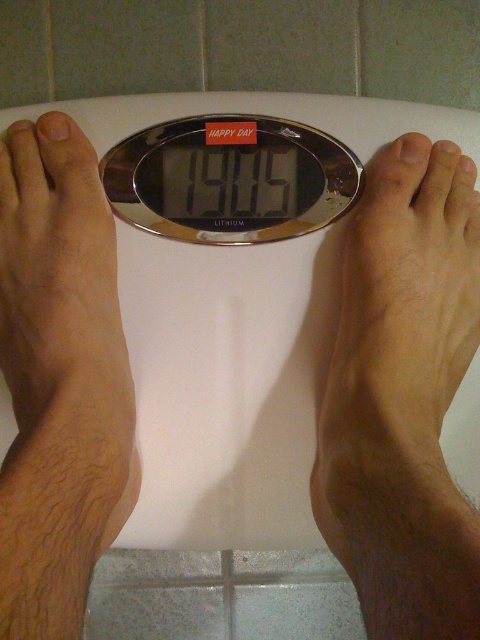
From the picture: Who is positioned more to the left, smooth skin foot at left or silver metallic scale at center?

From the viewer's perspective, smooth skin foot at left appears more on the left side.

Is point (34, 364) closer to viewer compared to point (135, 144)?

Yes.

Describe the element at coordinates (61, 348) in the screenshot. The height and width of the screenshot is (640, 480). I see `smooth skin foot at left` at that location.

I want to click on smooth skin foot at left, so click(x=61, y=348).